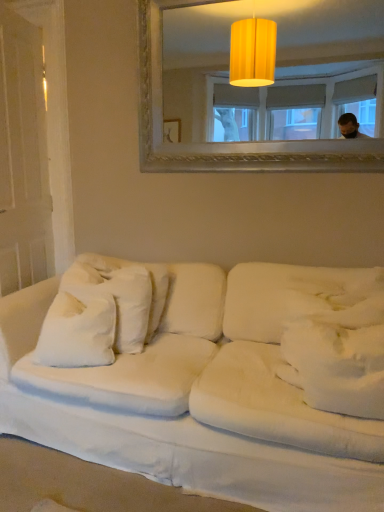
Question: From the image's perspective, is white soft pillow at center, the 1th pillow positioned from the front, positioned above or below white soft pillow at left, which is the 1th pillow from back to front?

Choices:
 (A) below
 (B) above

Answer: (A)

Question: From a real-world perspective, relative to white soft pillow at left, acting as the 2th pillow starting from the right, is white soft pillow at center, acting as the 1th pillow starting from the right, vertically above or below?

Choices:
 (A) below
 (B) above

Answer: (A)

Question: Which is nearer to the white soft pillow at left, acting as the 2th pillow starting from the right?

Choices:
 (A) white fabric couch at lower center
 (B) white soft pillow at center, the 1th pillow positioned from the front
 (C) matte gold mirror at upper center

Answer: (A)

Question: Estimate the real-world distances between objects in this image. Which object is farther from the white fabric couch at lower center?

Choices:
 (A) white soft pillow at center, acting as the 1th pillow starting from the right
 (B) matte gold mirror at upper center
 (C) white soft pillow at left, acting as the 1th pillow starting from the left

Answer: (B)